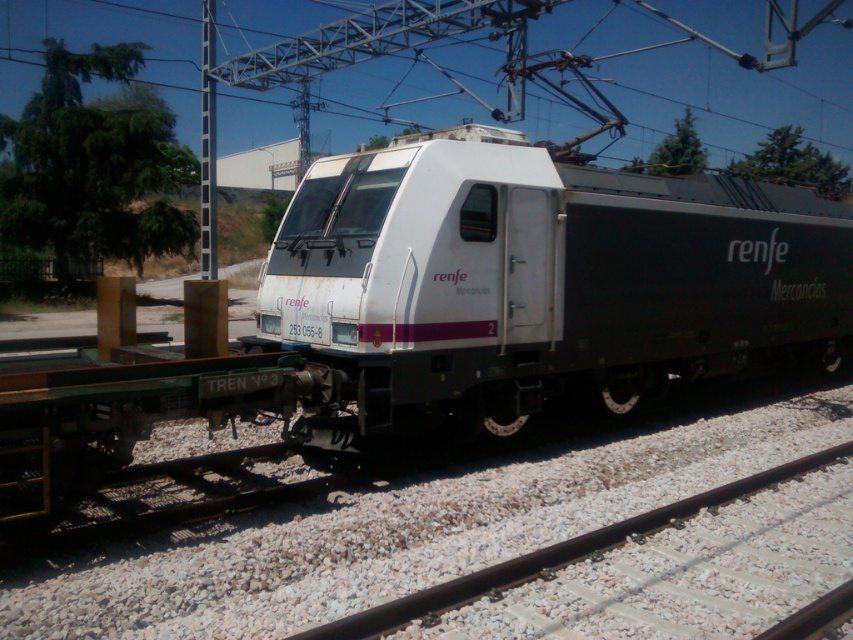
Does white matte train at center have a smaller size compared to black metal train track at lower center?

No.

Looking at this image, who is more forward, (637, 307) or (387, 602)?

Point (387, 602)

Identify the location of white matte train at center. (540, 278).